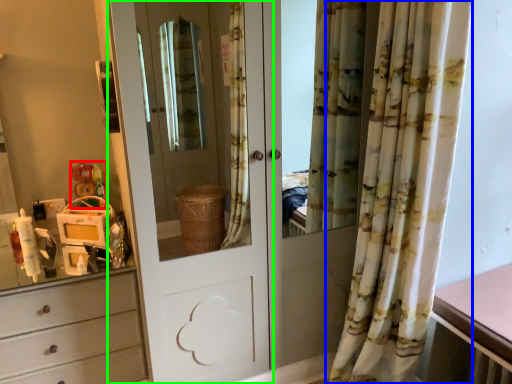
Question: Considering the real-world distances, which object is closest to toy (highlighted by a red box)? curtain (highlighted by a blue box) or door (highlighted by a green box).

Choices:
 (A) curtain
 (B) door

Answer: (A)